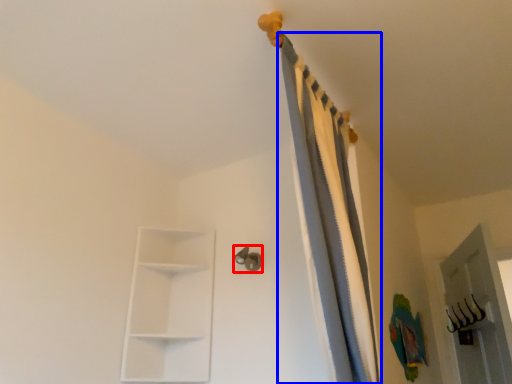
Question: Which object appears closest to the camera in this image, door handle (highlighted by a red box) or curtain (highlighted by a blue box)?

Choices:
 (A) door handle
 (B) curtain

Answer: (B)